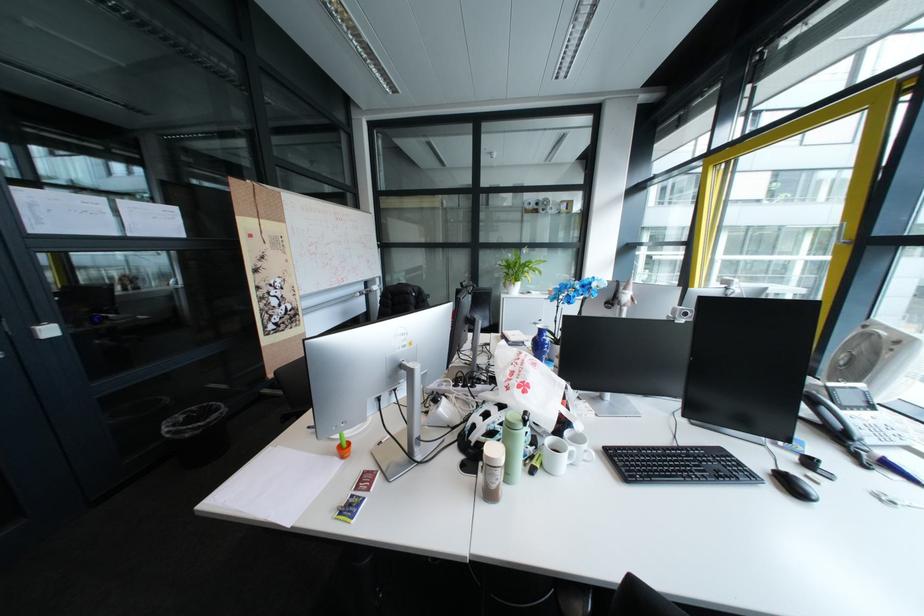
Where is `white coffee mug`? white coffee mug is located at coordinates (575, 456).